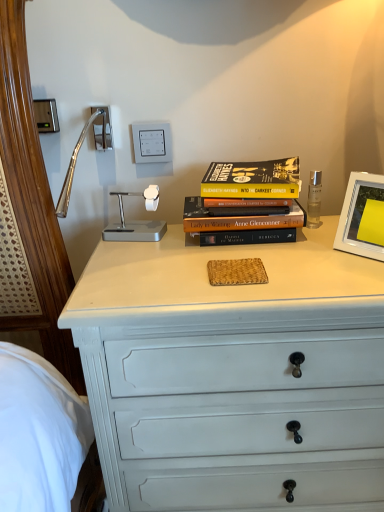
Image resolution: width=384 pixels, height=512 pixels. I want to click on vacant space situated above white painted wood chest of drawers at center (from a real-world perspective), so click(x=253, y=252).